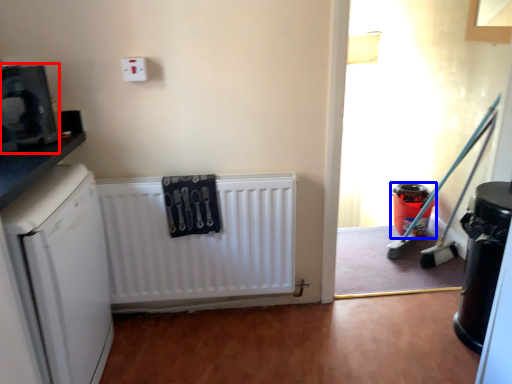
Question: Which point is further to the camera, appliance (highlighted by a red box) or appliance (highlighted by a blue box)?

Choices:
 (A) appliance
 (B) appliance

Answer: (B)